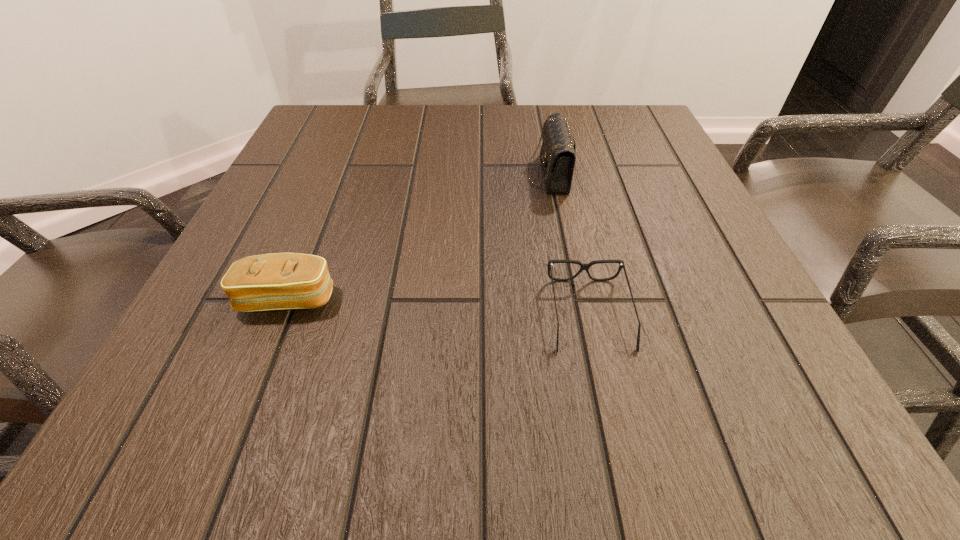
Find the location of a particular element. This screenshot has width=960, height=540. object at the left edge is located at coordinates (279, 281).

Locate an element on the screen. This screenshot has width=960, height=540. blank space at the far edge of the desktop is located at coordinates pyautogui.click(x=463, y=120).

Where is `blank space at the near edge of the desktop`? blank space at the near edge of the desktop is located at coordinates (314, 431).

The width and height of the screenshot is (960, 540). I want to click on vacant region at the left edge of the desktop, so click(311, 244).

This screenshot has width=960, height=540. I want to click on free space at the right edge, so click(666, 176).

Locate an element on the screen. Image resolution: width=960 pixels, height=540 pixels. free space at the far left corner is located at coordinates (335, 127).

In the image, there is a desktop. Identify the location of vacant space at the far right corner. This screenshot has height=540, width=960. (645, 129).

Where is `free location at the near right corner of the desktop`? free location at the near right corner of the desktop is located at coordinates (707, 454).

Locate an element on the screen. unoccupied area between the spectacles and the farthest object is located at coordinates (568, 244).

Identify the location of free area in between the farther clutch bag and the shortest object. (568, 244).